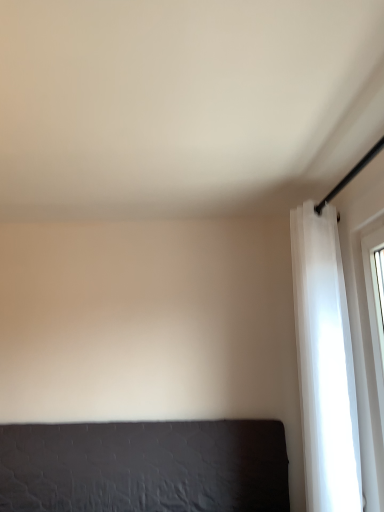
Question: From the image's perspective, does white sheer curtain at right appear higher than dark gray fabric bed at lower left?

Choices:
 (A) yes
 (B) no

Answer: (A)

Question: Is the position of white sheer curtain at right more distant than that of dark gray fabric bed at lower left?

Choices:
 (A) no
 (B) yes

Answer: (A)

Question: Can you confirm if white sheer curtain at right is taller than dark gray fabric bed at lower left?

Choices:
 (A) yes
 (B) no

Answer: (A)

Question: Is white sheer curtain at right with dark gray fabric bed at lower left?

Choices:
 (A) yes
 (B) no

Answer: (B)

Question: Is dark gray fabric bed at lower left surrounded by white sheer curtain at right?

Choices:
 (A) yes
 (B) no

Answer: (B)

Question: Considering the relative positions of white sheer curtain at right and dark gray fabric bed at lower left in the image provided, is white sheer curtain at right to the right of dark gray fabric bed at lower left from the viewer's perspective?

Choices:
 (A) no
 (B) yes

Answer: (B)

Question: From the image's perspective, is dark gray fabric bed at lower left on top of white sheer curtain at right?

Choices:
 (A) yes
 (B) no

Answer: (B)

Question: Considering the relative sizes of dark gray fabric bed at lower left and white sheer curtain at right in the image provided, is dark gray fabric bed at lower left shorter than white sheer curtain at right?

Choices:
 (A) no
 (B) yes

Answer: (B)

Question: Does dark gray fabric bed at lower left appear on the right side of white sheer curtain at right?

Choices:
 (A) yes
 (B) no

Answer: (B)

Question: Would you say dark gray fabric bed at lower left contains white sheer curtain at right?

Choices:
 (A) no
 (B) yes

Answer: (A)

Question: Is dark gray fabric bed at lower left positioned behind white sheer curtain at right?

Choices:
 (A) yes
 (B) no

Answer: (A)

Question: Is dark gray fabric bed at lower left wider than white sheer curtain at right?

Choices:
 (A) no
 (B) yes

Answer: (A)

Question: In the image, is dark gray fabric bed at lower left on the left side or the right side of white sheer curtain at right?

Choices:
 (A) right
 (B) left

Answer: (B)